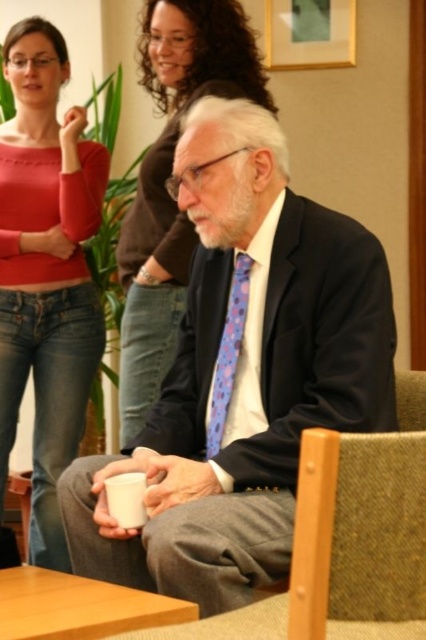
Can you confirm if blue dotted tie at center is positioned to the right of wooden chair at lower left?

Yes, blue dotted tie at center is to the right of wooden chair at lower left.

Who is positioned more to the right, blue dotted tie at center or wooden chair at lower left?

Positioned to the right is blue dotted tie at center.

Does point (230, 326) come in front of point (16, 484)?

Yes.

Identify the location of blue dotted tie at center. Image resolution: width=426 pixels, height=640 pixels. (227, 353).

Between point (154, 477) and point (221, 372), which one is positioned in front?

Positioned in front is point (154, 477).

This screenshot has height=640, width=426. In order to click on matte black suit at center in this screenshot , I will do `click(242, 372)`.

The width and height of the screenshot is (426, 640). What do you see at coordinates (242, 372) in the screenshot? I see `matte black suit at center` at bounding box center [242, 372].

The width and height of the screenshot is (426, 640). In order to click on matte black suit at center in this screenshot , I will do `click(242, 372)`.

The width and height of the screenshot is (426, 640). What do you see at coordinates (126, 499) in the screenshot?
I see `white matte cup at lower center` at bounding box center [126, 499].

Looking at this image, between white matte cup at lower center and wooden chair at lower left, which one appears on the right side from the viewer's perspective?

From the viewer's perspective, white matte cup at lower center appears more on the right side.

The width and height of the screenshot is (426, 640). What do you see at coordinates (126, 499) in the screenshot?
I see `white matte cup at lower center` at bounding box center [126, 499].

Identify the location of white matte cup at lower center. (126, 499).